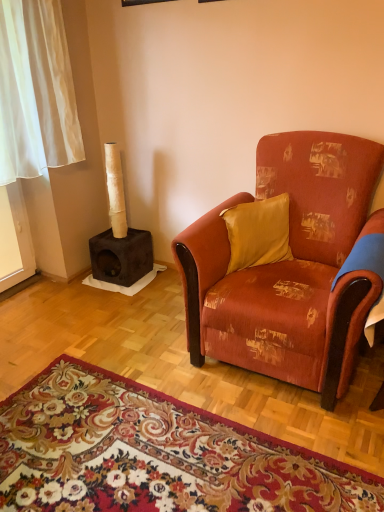
Where is `vacant region to the left of textured orange fabric armchair at center`? This screenshot has height=512, width=384. vacant region to the left of textured orange fabric armchair at center is located at coordinates (143, 343).